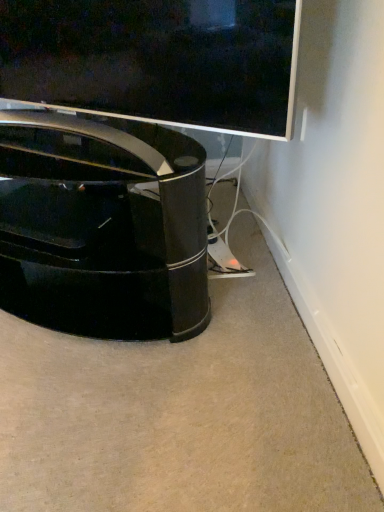
Describe the element at coordinates (102, 226) in the screenshot. This screenshot has width=384, height=512. I see `glossy black coffee table at lower left` at that location.

The height and width of the screenshot is (512, 384). I want to click on glossy black coffee table at lower left, so click(x=102, y=226).

At what (x,y) coordinates should I click in order to perform the action: click on glossy black coffee table at lower left. Please return your answer as a coordinate pair (x, y). Looking at the image, I should click on (102, 226).